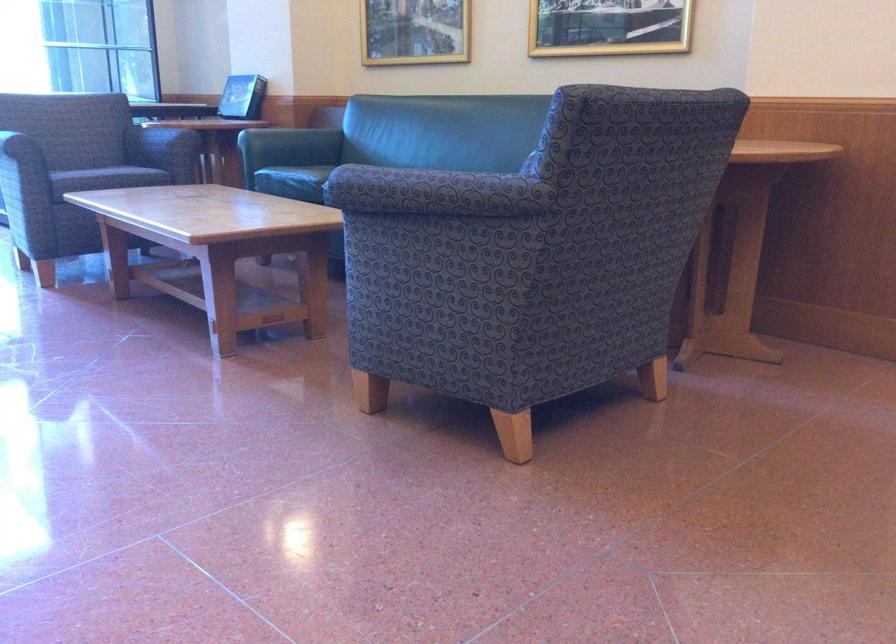
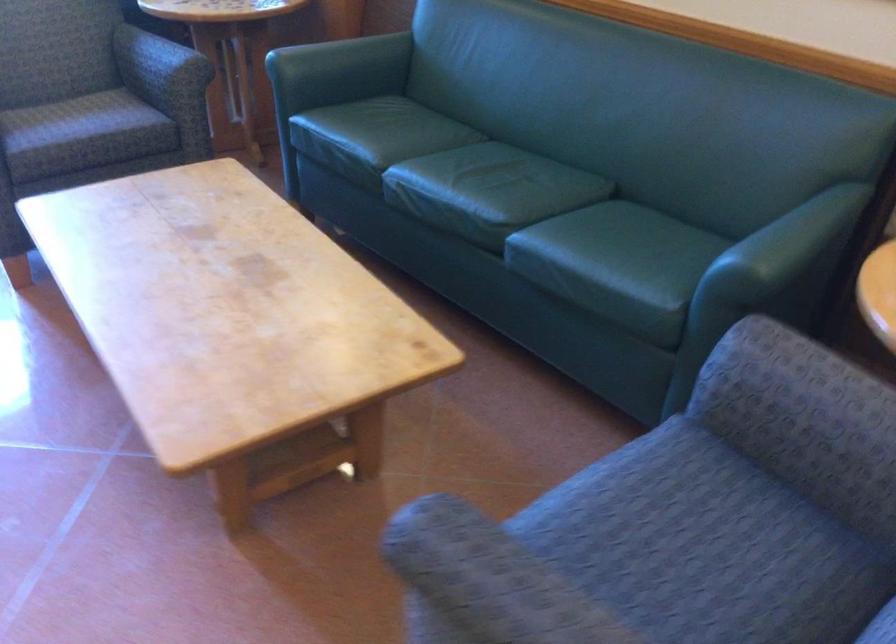
Where in the second image is the point corresponding to (x=157, y=134) from the first image?

(158, 62)